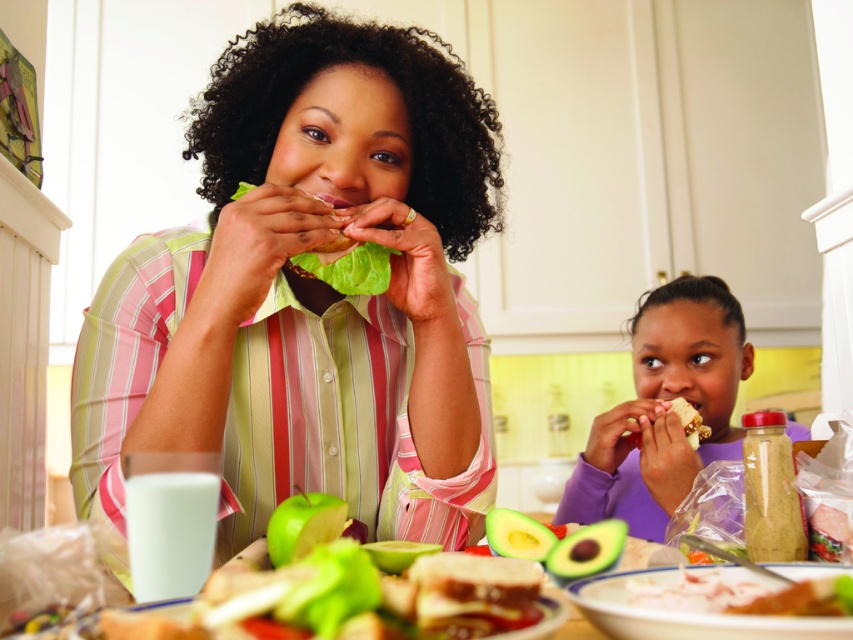
You are a photographer trying to capture a candid shot of the purple matte shirt at lower right and the smooth white bread at right. Since you want to include both in the frame, which object should you position closer to the center of the photo?

The smooth white bread at right is on the right side of the purple matte shirt at lower right, so to include both in the frame, position the purple matte shirt at lower right closer to the center.

You are a chef preparing to place a decorative plate on the table. The plate is 12 inches in diameter. Can the purple matte shirt at lower right and the smooth white bread at right fit on the plate without overlapping?

The purple matte shirt at lower right might be wider than smooth white bread at right. Since the plate is 12 inches in diameter, if the shirt is wider than the bread but still within the plate size, they could fit without overlapping. However, if the shirt exceeds the plate diameter, it won